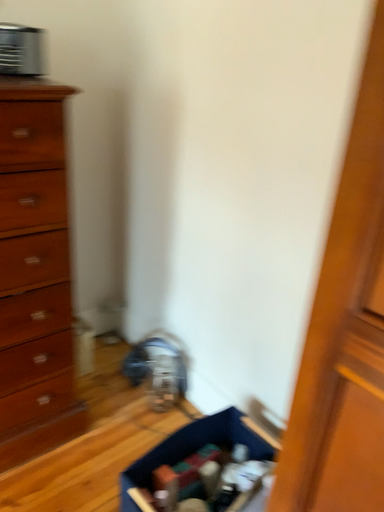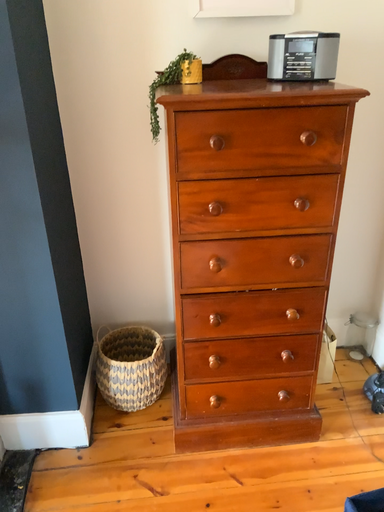
Question: How did the camera likely rotate when shooting the video?

Choices:
 (A) rotated right
 (B) rotated left

Answer: (B)